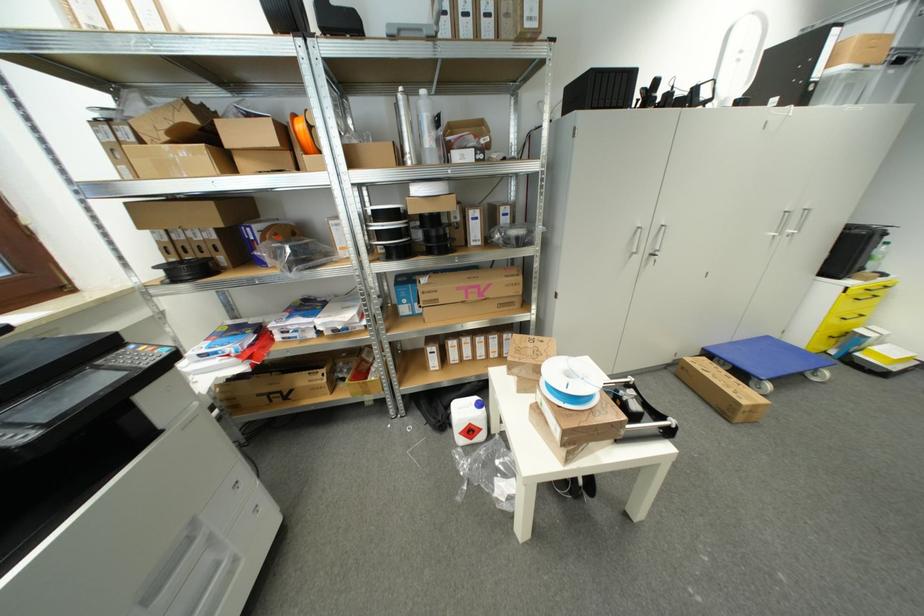
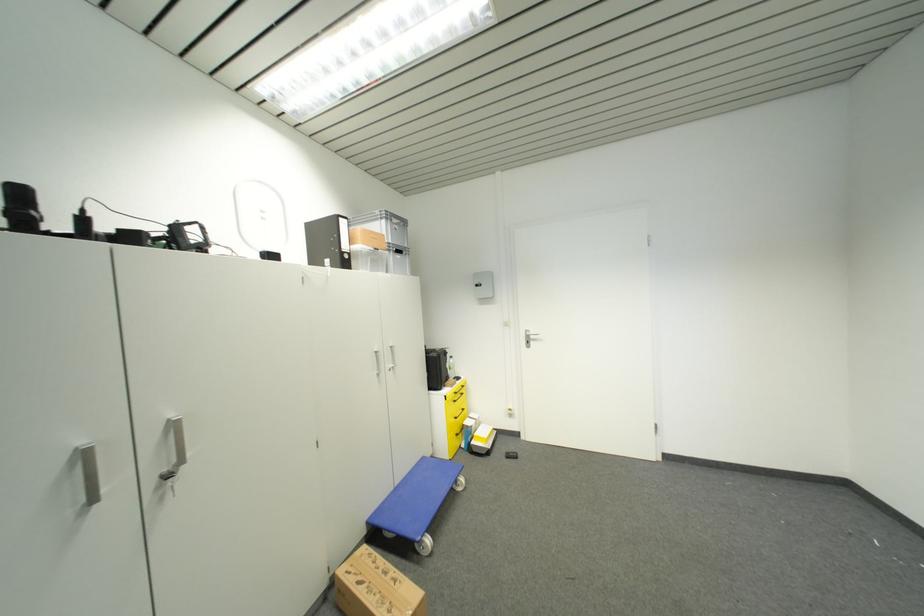
Question: The images are taken continuously from a first-person perspective. In which direction is your viewpoint rotating?

Choices:
 (A) Left
 (B) Right
 (C) Up
 (D) Down

Answer: (B)